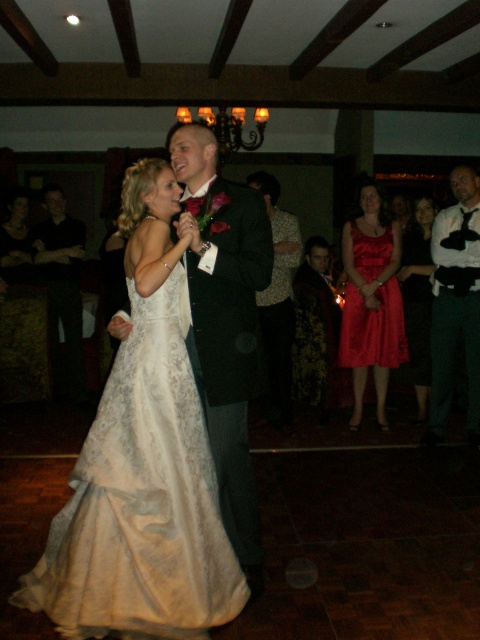
Question: Which point is closer to the camera?

Choices:
 (A) (421, 408)
 (B) (288, 346)
 (C) (118, 593)

Answer: (C)

Question: Does dark green textured suit at right appear over black smooth suit at left?

Choices:
 (A) no
 (B) yes

Answer: (A)

Question: Which of these objects is positioned closest to the black smooth suit at left?

Choices:
 (A) shiny red dress at right
 (B) dark green textured suit at right
 (C) silky red dress at center
 (D) shiny red dress at center

Answer: (C)

Question: Can you confirm if dark green suit at center is smaller than shiny red dress at center?

Choices:
 (A) no
 (B) yes

Answer: (A)

Question: Can you confirm if dark green textured suit at right is positioned below shiny red dress at right?

Choices:
 (A) no
 (B) yes

Answer: (B)

Question: Among these points, which one is nearest to the camera?

Choices:
 (A) (180, 552)
 (B) (424, 273)
 (C) (183, 164)

Answer: (A)